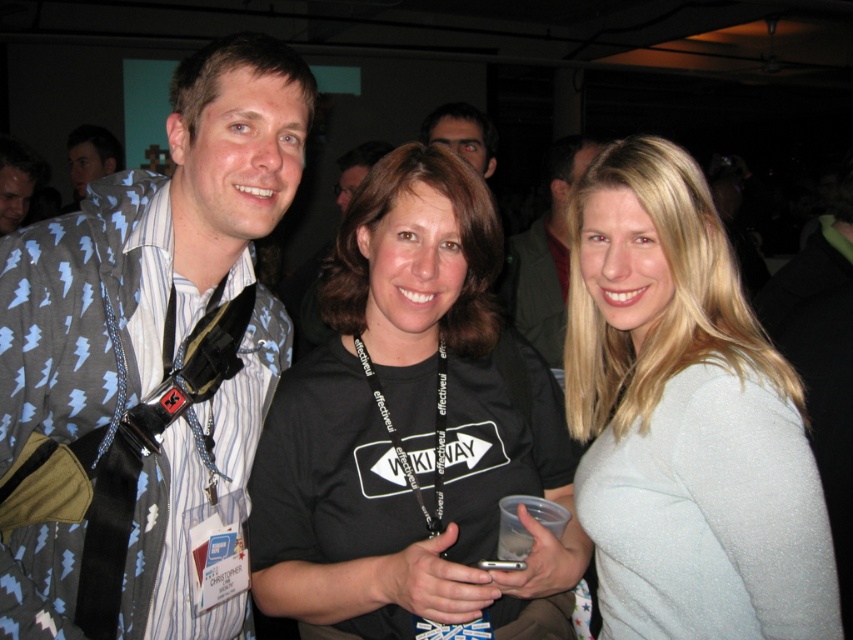
You are standing at the camera position and want to take a photo of the three people. However, you realize that the camera has a minimum focus distance of 3 meters. Will the point at coordinates point (549, 324) be in focus?

The point at coordinates point (549, 324) is 2.75 meters from the camera, which is closer than the minimum focus distance of 3 meters. Therefore, the point will not be in focus.

You are organizing a clothing inventory and need to place the black matte shirt at center and the matte black shirt at center into storage. The storage unit has a width of 4 feet. Can both items fit side by side without overlapping?

The black matte shirt at center and the matte black shirt at center are 4.16 feet apart. Since the storage unit is only 4 feet wide, they cannot fit side by side without overlapping.